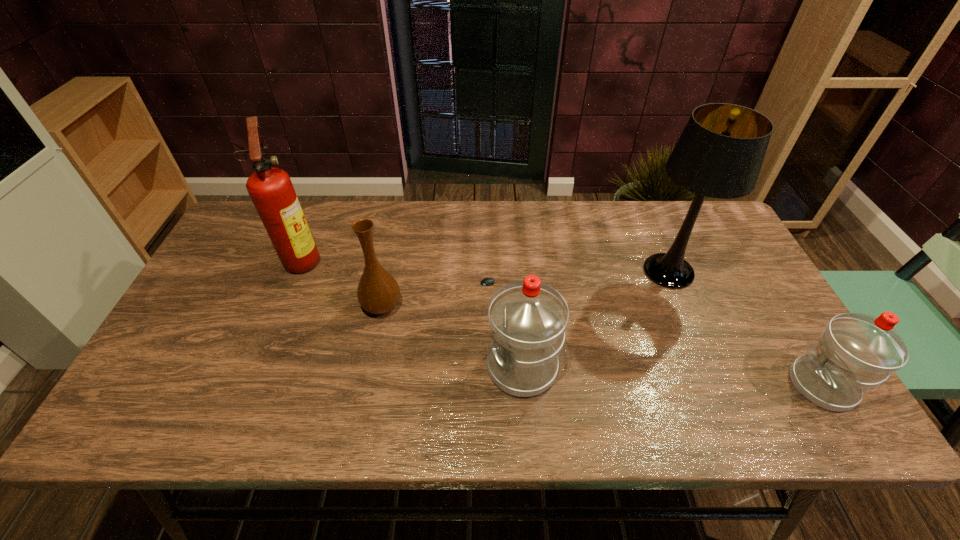
You are a GUI agent. You are given a task and a screenshot of the screen. Output one action in this format:
    pyautogui.click(x=<x>, y=<y>)
    Task: Click on the left water bottle
    
    Given the screenshot: What is the action you would take?
    pyautogui.click(x=527, y=318)

You are a GUI agent. You are given a task and a screenshot of the screen. Output one action in this format:
    pyautogui.click(x=<x>, y=<y>)
    Task: Click on the right water bottle
    
    Given the screenshot: What is the action you would take?
    pyautogui.click(x=856, y=352)

Find the location of a particular element. the rightmost object is located at coordinates (856, 352).

You are a GUI agent. You are given a task and a screenshot of the screen. Output one action in this format:
    pyautogui.click(x=<x>, y=<y>)
    Task: Click on the vase
    The height and width of the screenshot is (540, 960).
    Given the screenshot: What is the action you would take?
    pyautogui.click(x=378, y=292)

Locate an element on the screen. The image size is (960, 540). the fifth object from left to right is located at coordinates (720, 152).

Identify the location of mouse. (488, 281).

I want to click on fire extinguisher, so point(270,189).

At what (x,y) coordinates should I click in order to perform the action: click on free space located on the handle side of the left water bottle. Please return your answer as a coordinate pair (x, y). Looking at the image, I should click on (352, 367).

Where is `vacant region located on the handle side of the left water bottle`? The image size is (960, 540). vacant region located on the handle side of the left water bottle is located at coordinates (319, 367).

The image size is (960, 540). Identify the location of vacant region located 0.350m on the handle side of the left water bottle. (340, 367).